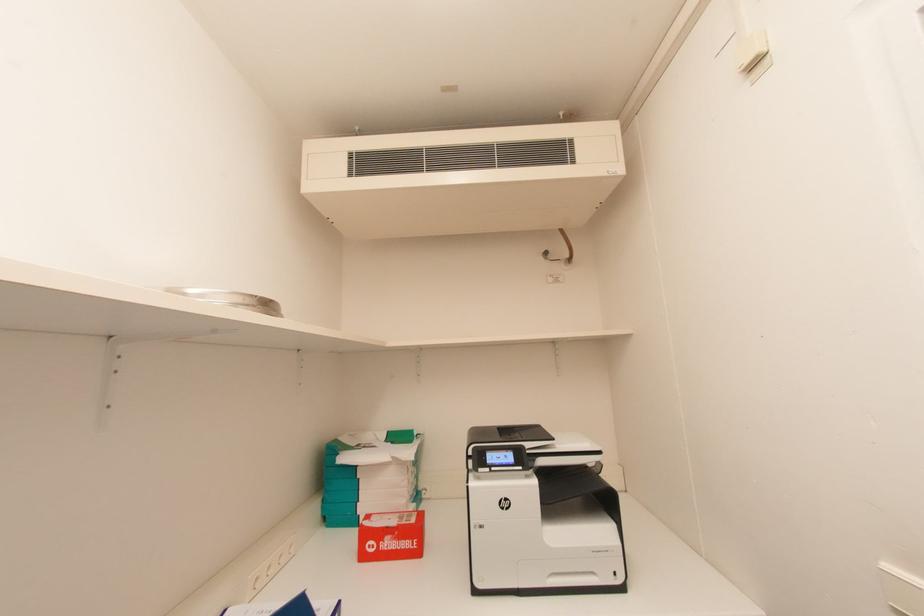
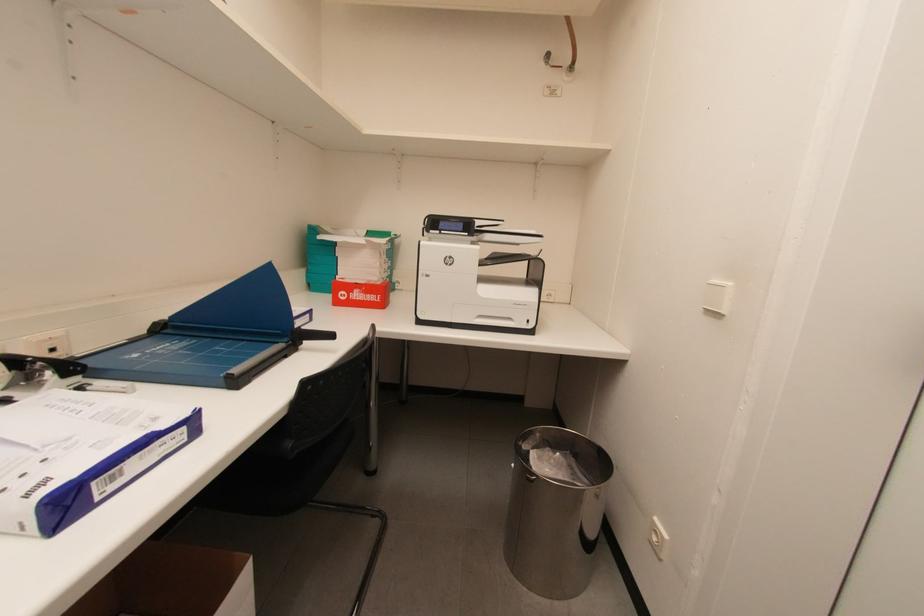
Question: The first image is from the beginning of the video and the second image is from the end. How did the camera likely rotate when shooting the video?

Choices:
 (A) Left
 (B) Right
 (C) Up
 (D) Down

Answer: (D)